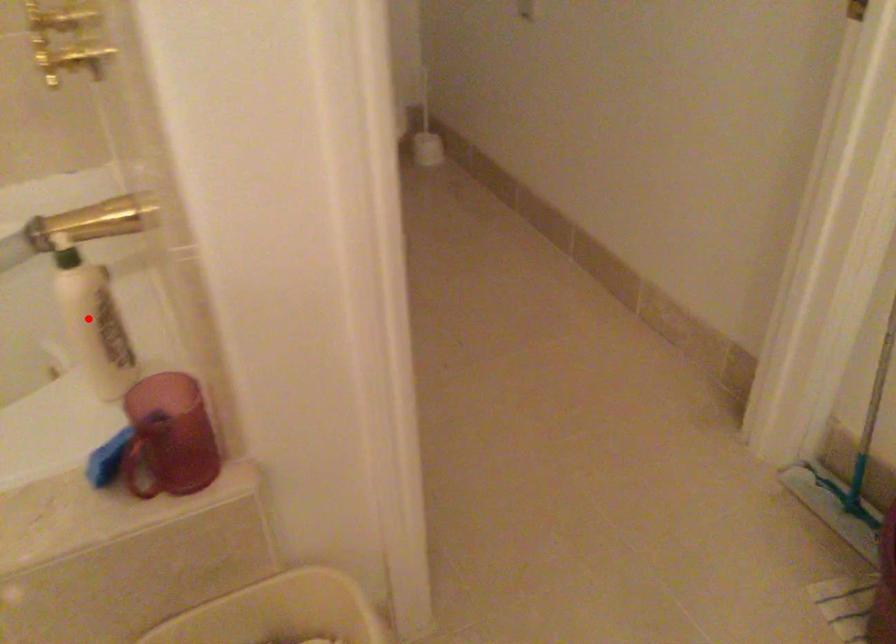
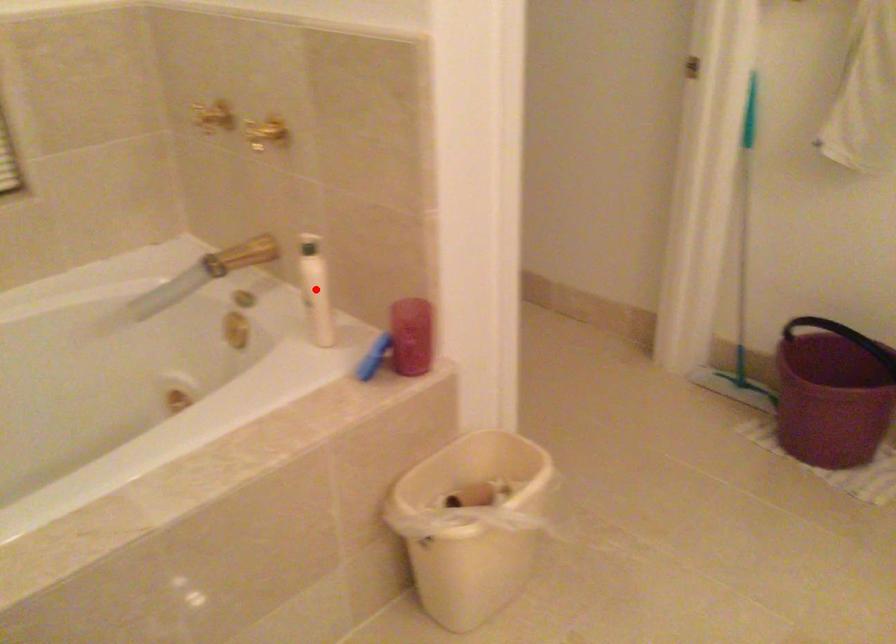
I am providing you with two images of the same scene from different viewpoints. A red point is marked on the first image and another point is marked on the second image. Does the point marked in image1 correspond to the same location as the one in image2?

Yes